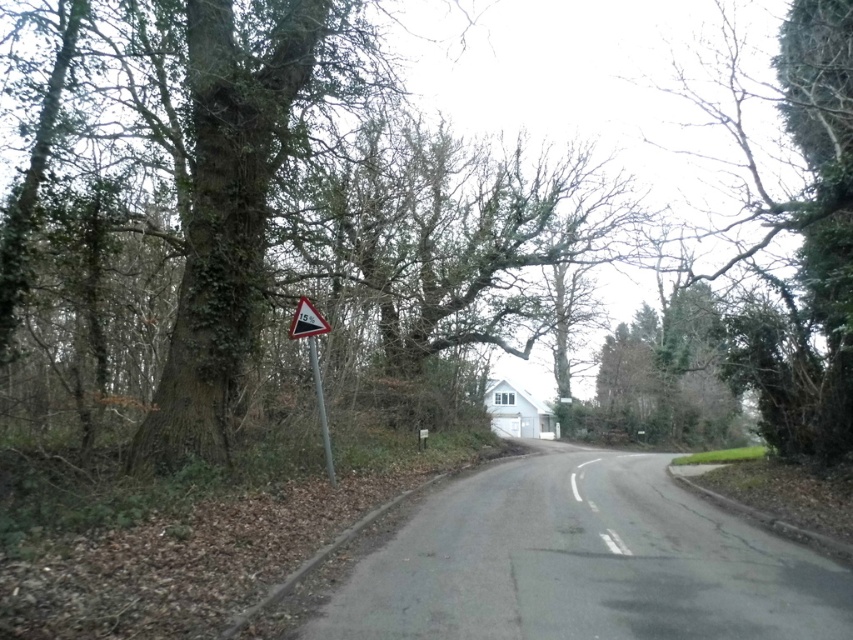
What do you see at coordinates (312, 362) in the screenshot?
I see `black plastic triangle at left` at bounding box center [312, 362].

Who is more distant from viewer, (328,464) or (318,400)?

The point (328,464) is more distant.

Who is more forward, (318, 419) or (323, 424)?

Point (323, 424) is more forward.

I want to click on black plastic triangle at left, so click(312, 362).

Looking at this image, does black plastic triangle at left have a lesser height compared to white plastic speed limit sign at center-left?

In fact, black plastic triangle at left may be taller than white plastic speed limit sign at center-left.

What do you see at coordinates (312, 362) in the screenshot? I see `black plastic triangle at left` at bounding box center [312, 362].

In order to click on black plastic triangle at left in this screenshot , I will do `click(312, 362)`.

Does green leafy tree at upper right have a greater height compared to metal pole at left?

Correct, green leafy tree at upper right is much taller as metal pole at left.

Can you confirm if green leafy tree at upper right is smaller than metal pole at left?

No.

Between point (844, 433) and point (312, 362), which one is positioned behind?

The point (844, 433) is more distant.

You are a GUI agent. You are given a task and a screenshot of the screen. Output one action in this format:
    pyautogui.click(x=<x>, y=<y>)
    Task: Click on the green leafy tree at upper right
    
    Given the screenshot: What is the action you would take?
    pyautogui.click(x=793, y=230)